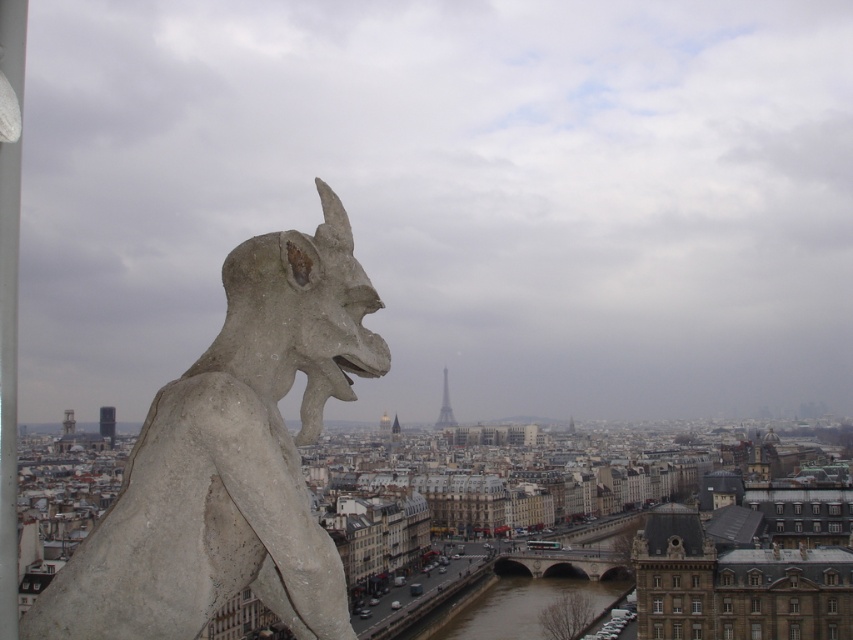
Which is more to the left, gray stone gargoyle at upper left or metallic silver tower at center?

gray stone gargoyle at upper left is more to the left.

Does gray stone gargoyle at upper left have a lesser height compared to metallic silver tower at center?

Yes, gray stone gargoyle at upper left is shorter than metallic silver tower at center.

Does point (227, 288) lie behind point (445, 410)?

No, (227, 288) is closer to viewer.

What are the coordinates of `gray stone gargoyle at upper left` in the screenshot? It's located at (231, 458).